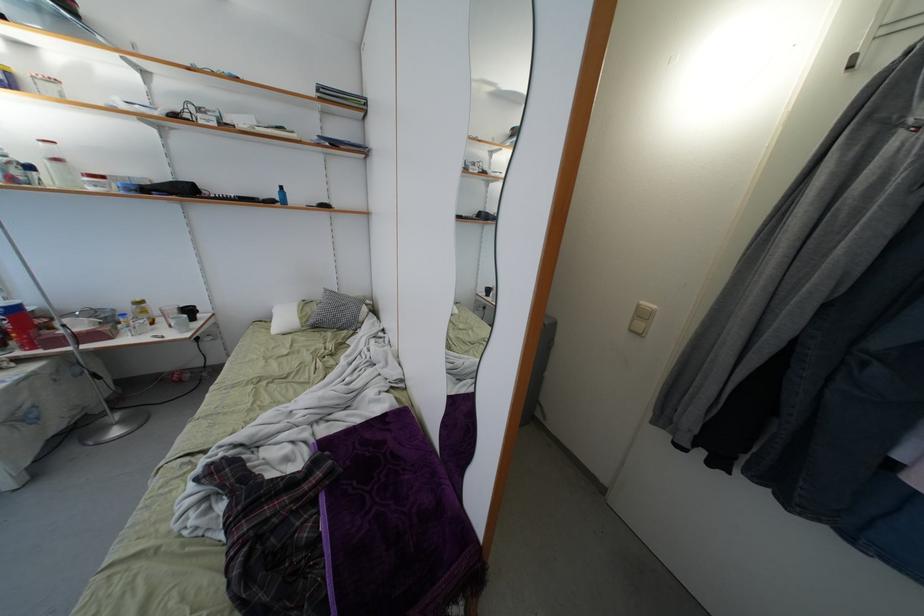
Where is `black mug`? black mug is located at coordinates (188, 312).